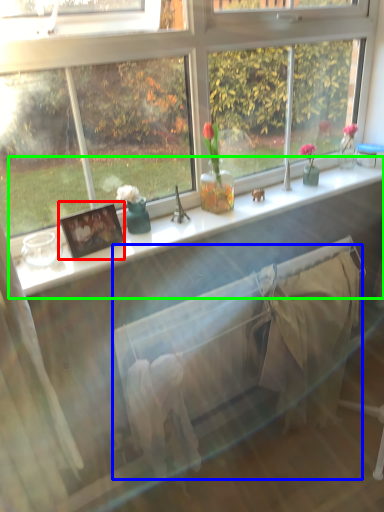
Question: Which is farther away from picture frame (highlighted by a red box)? bed frame (highlighted by a blue box) or window sill (highlighted by a green box)?

Choices:
 (A) bed frame
 (B) window sill

Answer: (A)